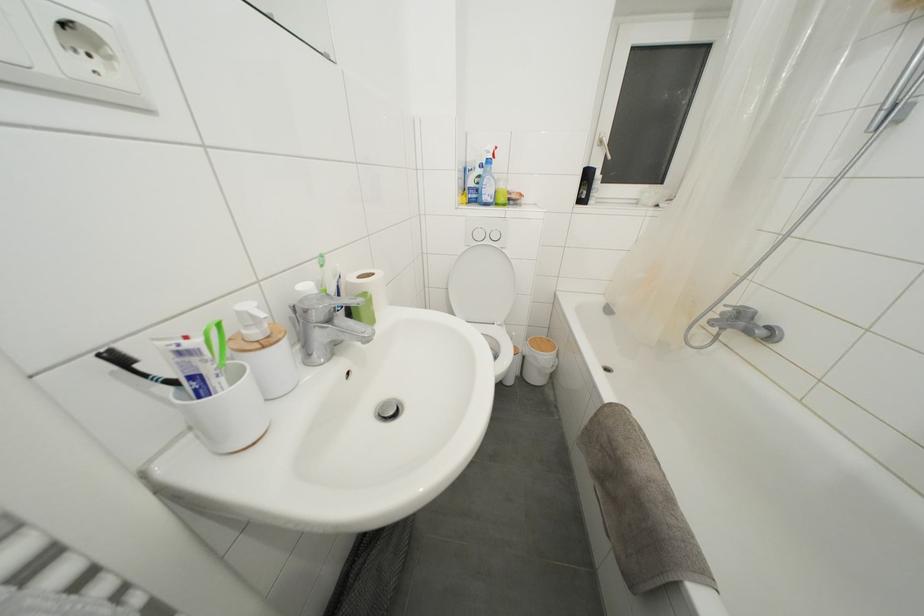
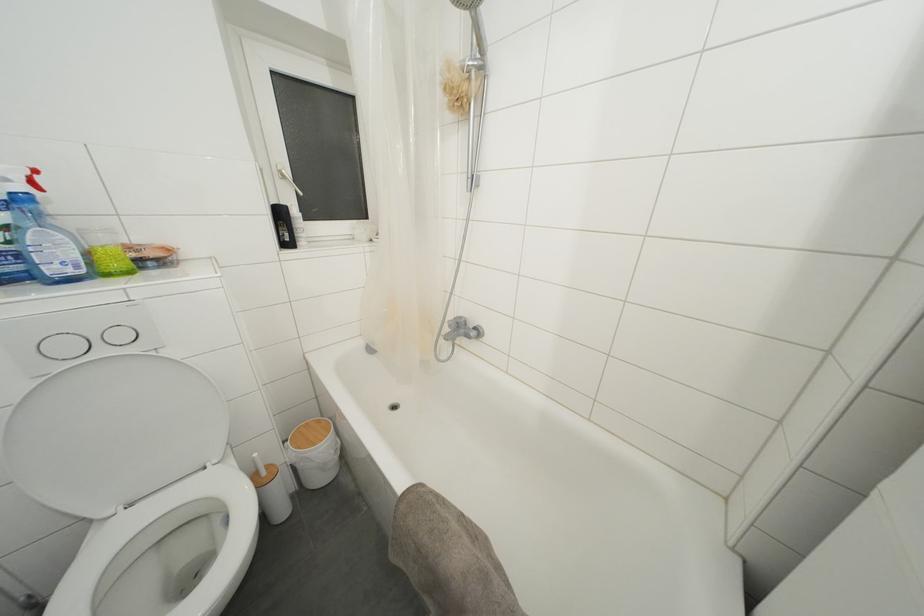
In the second image, find the point that corresponds to point 483,240 in the first image.

(71, 352)